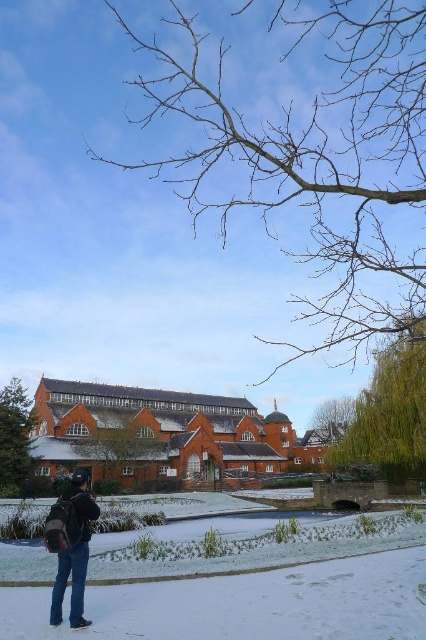
Who is lower down, green leafy tree at lower left or green leafy tree at upper center?

green leafy tree at upper center

Can you confirm if green leafy tree at lower left is positioned to the right of green leafy tree at upper center?

Incorrect, green leafy tree at lower left is not on the right side of green leafy tree at upper center.

Identify the location of green leafy tree at lower left. (14, 435).

The height and width of the screenshot is (640, 426). Describe the element at coordinates (71, 547) in the screenshot. I see `matte black backpack at lower left` at that location.

Is matte black backpack at lower left wider than green leafy tree at lower left?

In fact, matte black backpack at lower left might be narrower than green leafy tree at lower left.

Who is more forward, (69, 536) or (28, 429)?

Positioned in front is point (69, 536).

You are a GUI agent. You are given a task and a screenshot of the screen. Output one action in this format:
    pyautogui.click(x=<x>, y=<y>)
    Task: Click on the matte black backpack at lower left
    This screenshot has height=640, width=426.
    Given the screenshot: What is the action you would take?
    pyautogui.click(x=71, y=547)

Which is more to the left, green leafy tree at center or matte black backpack at lower left?

From the viewer's perspective, matte black backpack at lower left appears more on the left side.

Between green leafy tree at center and matte black backpack at lower left, which one has more height?

With more height is green leafy tree at center.

Who is more distant from viewer, (376, 426) or (80, 474)?

Positioned behind is point (376, 426).

This screenshot has height=640, width=426. Identify the location of green leafy tree at center. (389, 412).